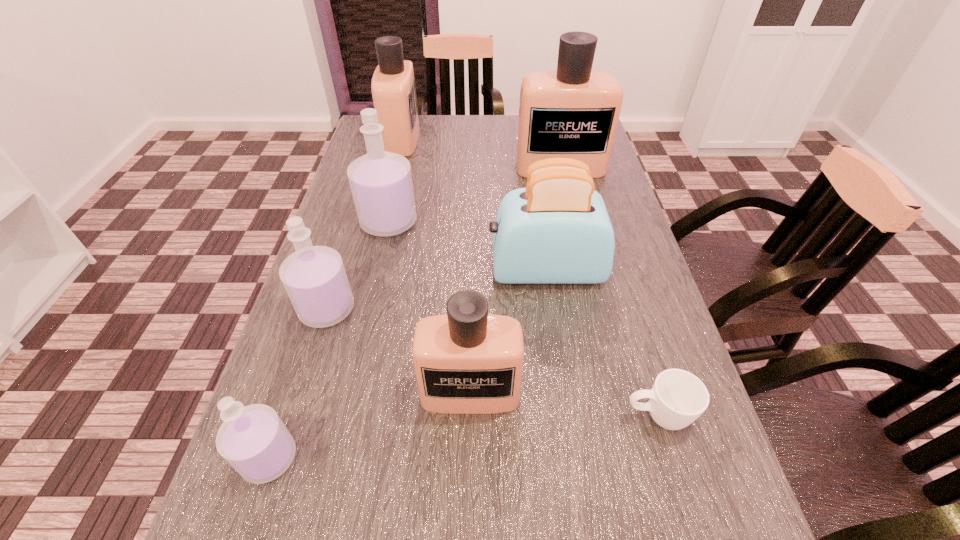
Where is `the biggest beige perfume`? the biggest beige perfume is located at coordinates (572, 112).

The height and width of the screenshot is (540, 960). In order to click on the tallest perfume in this screenshot , I will do `click(572, 112)`.

Locate an element on the screen. the third smallest beige perfume is located at coordinates coord(393,87).

The height and width of the screenshot is (540, 960). In order to click on the farthest purple perfume in this screenshot , I will do `click(381, 184)`.

Image resolution: width=960 pixels, height=540 pixels. I want to click on the third farthest object, so click(x=381, y=184).

The width and height of the screenshot is (960, 540). I want to click on toaster, so click(x=557, y=230).

This screenshot has width=960, height=540. I want to click on the second farthest purple perfume, so click(x=314, y=277).

This screenshot has height=540, width=960. I want to click on the fourth farthest perfume, so click(x=314, y=277).

The image size is (960, 540). I want to click on the third biggest beige perfume, so click(467, 361).

Identify the location of the third nearest perfume. (467, 361).